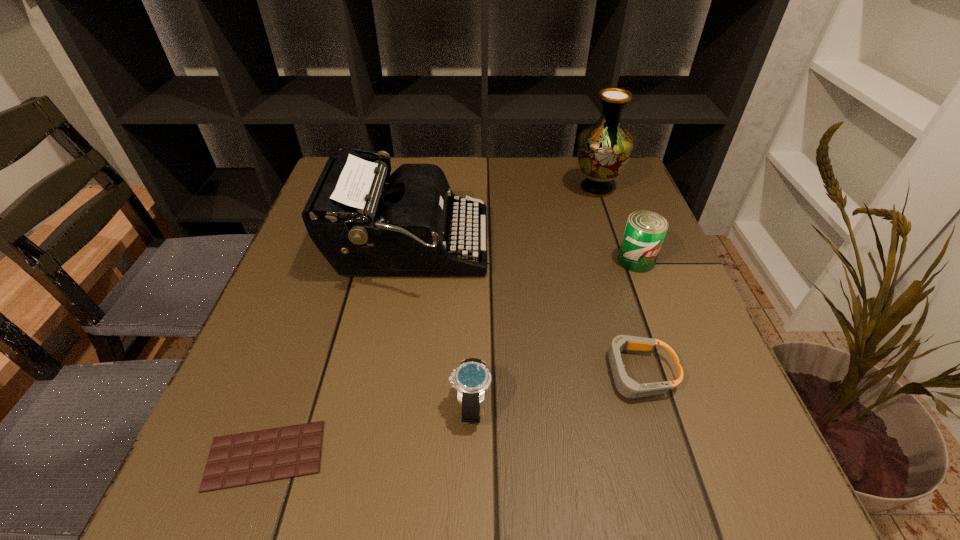
Where is `vacant region located on the left of the watch`? The width and height of the screenshot is (960, 540). vacant region located on the left of the watch is located at coordinates (357, 404).

Locate an element on the screen. The height and width of the screenshot is (540, 960). blank space located on the front and back of the fifth tallest object is located at coordinates (388, 373).

This screenshot has height=540, width=960. I want to click on free region located on the front and back of the fifth tallest object, so click(423, 373).

This screenshot has width=960, height=540. I want to click on vacant space located 0.070m on the front and back of the fifth tallest object, so click(x=560, y=373).

Identify the location of vacant space located on the right of the chocolate bar. The width and height of the screenshot is (960, 540). (564, 455).

The height and width of the screenshot is (540, 960). I want to click on vase present at the far edge, so pyautogui.click(x=604, y=148).

Locate an element on the screen. typewriter that is at the far edge is located at coordinates (362, 226).

Locate an element on the screen. The height and width of the screenshot is (540, 960). object that is at the near edge is located at coordinates (248, 458).

You are a GUI agent. You are given a task and a screenshot of the screen. Output one action in this format:
    pyautogui.click(x=<x>, y=<y>)
    Task: Click on the typewriter positioned at the left edge
    The height and width of the screenshot is (540, 960).
    Given the screenshot: What is the action you would take?
    pyautogui.click(x=362, y=226)

Identify the location of chocolate bar located in the left edge section of the desktop. The image size is (960, 540). (248, 458).